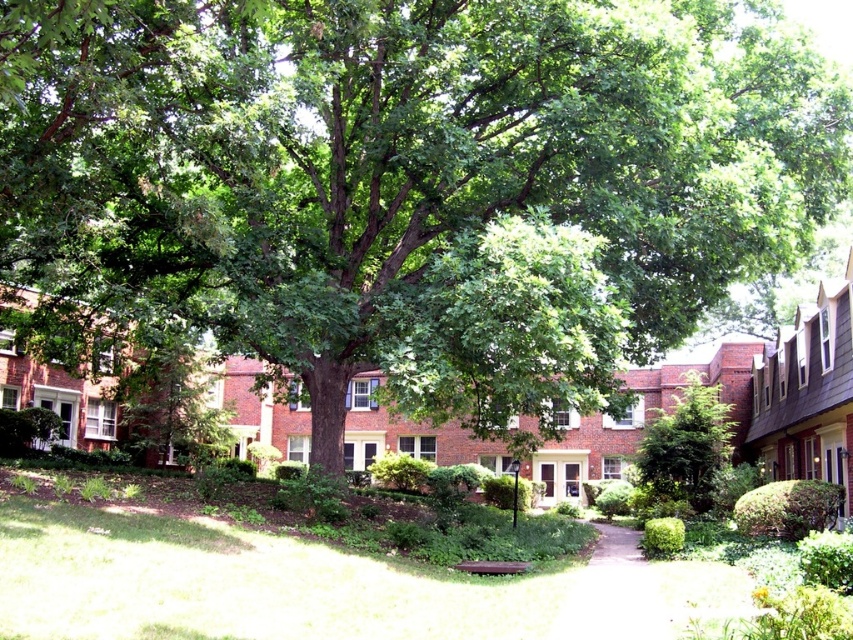
Can you confirm if green leafy tree at center is positioned above white gravel path at center?

Correct, green leafy tree at center is located above white gravel path at center.

Between point (695, 406) and point (645, 593), which one is positioned behind?

The point (695, 406) is behind.

The image size is (853, 640). Describe the element at coordinates (686, 444) in the screenshot. I see `green leafy tree at center` at that location.

This screenshot has height=640, width=853. I want to click on green leafy tree at center, so click(x=686, y=444).